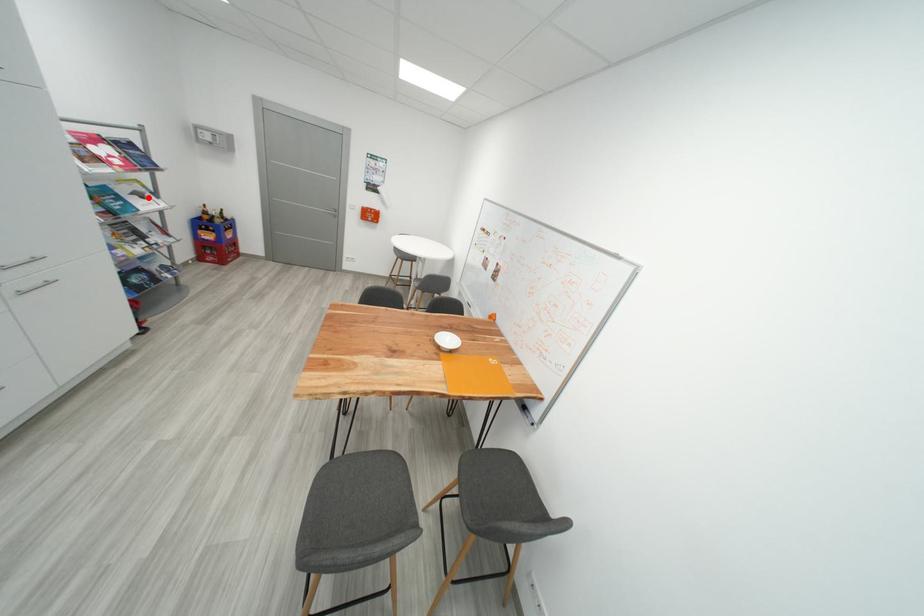
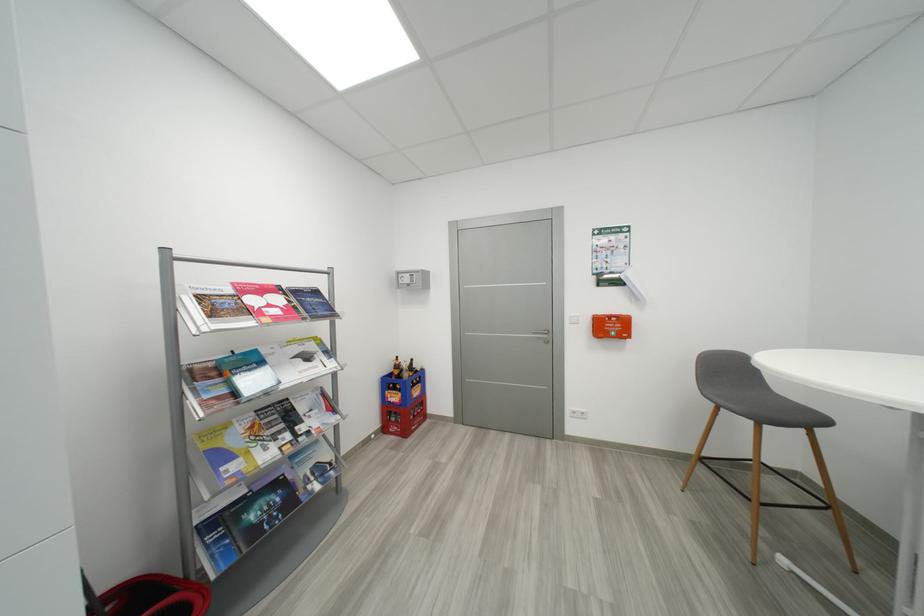
Locate, in the second image, the point that corresponds to the highlighted location in the first image.

(314, 359)